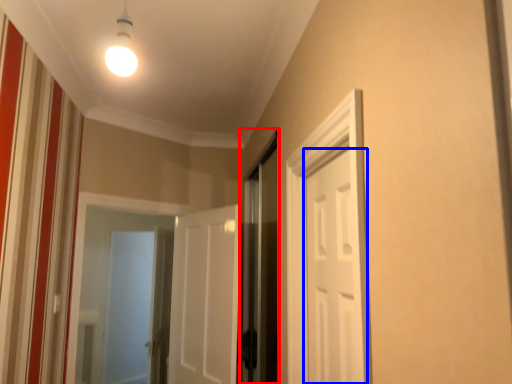
Question: Which of the following is the closest to the observer, screen door (highlighted by a red box) or door (highlighted by a blue box)?

Choices:
 (A) screen door
 (B) door

Answer: (B)